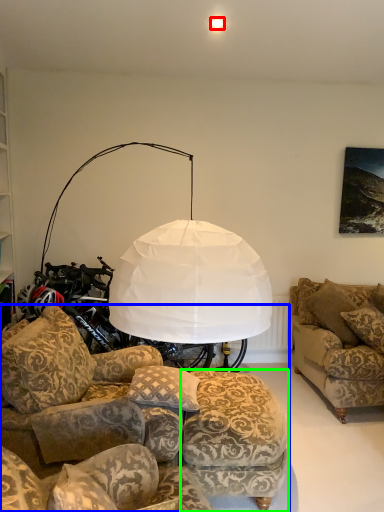
Question: Estimate the real-world distances between objects in this image. Which object is closer to lighting (highlighted by a red box), studio couch (highlighted by a blue box) or footrest (highlighted by a green box)?

Choices:
 (A) studio couch
 (B) footrest

Answer: (A)